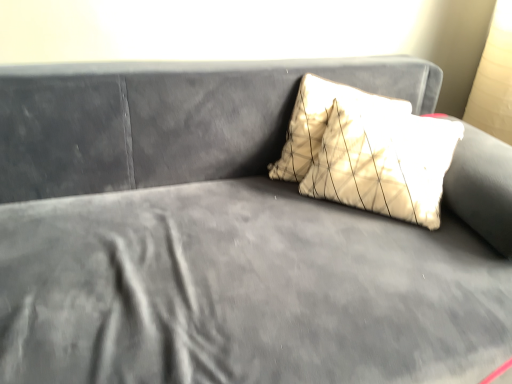
What do you see at coordinates (322, 122) in the screenshot? I see `white textured pillow at upper right` at bounding box center [322, 122].

Image resolution: width=512 pixels, height=384 pixels. What are the coordinates of `white textured pillow at upper right` in the screenshot? It's located at (322, 122).

Locate an element on the screen. The image size is (512, 384). white textured pillow at upper right is located at coordinates (322, 122).